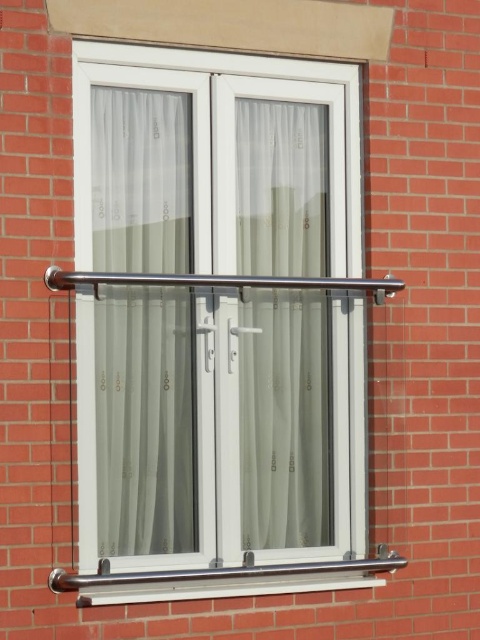
Question: Which point is closer to the camera?

Choices:
 (A) (167, 141)
 (B) (295, 256)

Answer: (A)

Question: Which of these objects is positioned closest to the translucent fabric curtain at center?

Choices:
 (A) white plastic window sill at lower center
 (B) white plastic glass door at center
 (C) sheer fabric curtain at center

Answer: (B)

Question: Does white plastic glass door at center lie behind sheer fabric curtain at center?

Choices:
 (A) yes
 (B) no

Answer: (B)

Question: Based on their relative distances, which object is farther from the white plastic window sill at lower center?

Choices:
 (A) translucent fabric curtain at center
 (B) polished stainless steel handrail at center
 (C) white plastic glass door at center

Answer: (B)

Question: Does white plastic glass door at center have a lesser width compared to white plastic window sill at lower center?

Choices:
 (A) yes
 (B) no

Answer: (A)

Question: Observing the image, what is the correct spatial positioning of white plastic glass door at center in reference to sheer fabric curtain at center?

Choices:
 (A) left
 (B) right

Answer: (B)